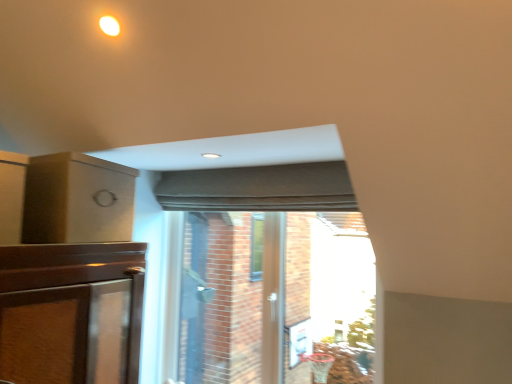
Question: Is transparent glass door at center in front of matte brown box at upper left?

Choices:
 (A) no
 (B) yes

Answer: (A)

Question: Are transparent glass door at center and matte brown box at upper left located far from each other?

Choices:
 (A) no
 (B) yes

Answer: (A)

Question: Is matte brown box at upper left surrounded by transparent glass door at center?

Choices:
 (A) yes
 (B) no

Answer: (B)

Question: Does transparent glass door at center appear on the right side of matte brown box at upper left?

Choices:
 (A) no
 (B) yes

Answer: (B)

Question: Does transparent glass door at center have a larger size compared to matte brown box at upper left?

Choices:
 (A) no
 (B) yes

Answer: (B)

Question: In terms of height, does matte gray curtain at center look taller or shorter compared to transparent glass door at center?

Choices:
 (A) tall
 (B) short

Answer: (B)

Question: Is matte gray curtain at center bigger or smaller than transparent glass door at center?

Choices:
 (A) big
 (B) small

Answer: (B)

Question: Is matte gray curtain at center to the left or to the right of transparent glass door at center in the image?

Choices:
 (A) left
 (B) right

Answer: (A)

Question: Is matte gray curtain at center in front of or behind transparent glass door at center in the image?

Choices:
 (A) behind
 (B) front

Answer: (A)

Question: Is matte brown box at upper left wider or thinner than transparent glass door at center?

Choices:
 (A) wide
 (B) thin

Answer: (A)

Question: Relative to transparent glass door at center, is matte brown box at upper left in front or behind?

Choices:
 (A) front
 (B) behind

Answer: (A)

Question: Which is correct: matte brown box at upper left is inside transparent glass door at center, or outside of it?

Choices:
 (A) inside
 (B) outside

Answer: (B)

Question: Considering the positions of point (100, 203) and point (200, 292), is point (100, 203) closer or farther from the camera than point (200, 292)?

Choices:
 (A) farther
 (B) closer

Answer: (B)

Question: In terms of height, does matte gray curtain at center look taller or shorter compared to matte brown box at upper left?

Choices:
 (A) tall
 (B) short

Answer: (B)

Question: Is point (159, 193) closer or farther from the camera than point (45, 213)?

Choices:
 (A) farther
 (B) closer

Answer: (A)